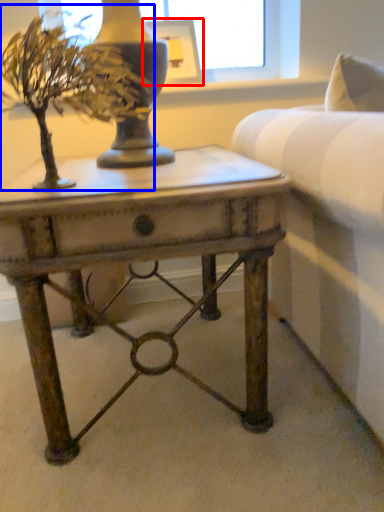
Question: Which of the following is the farthest to the observer, picture frame (highlighted by a red box) or houseplant (highlighted by a blue box)?

Choices:
 (A) picture frame
 (B) houseplant

Answer: (A)